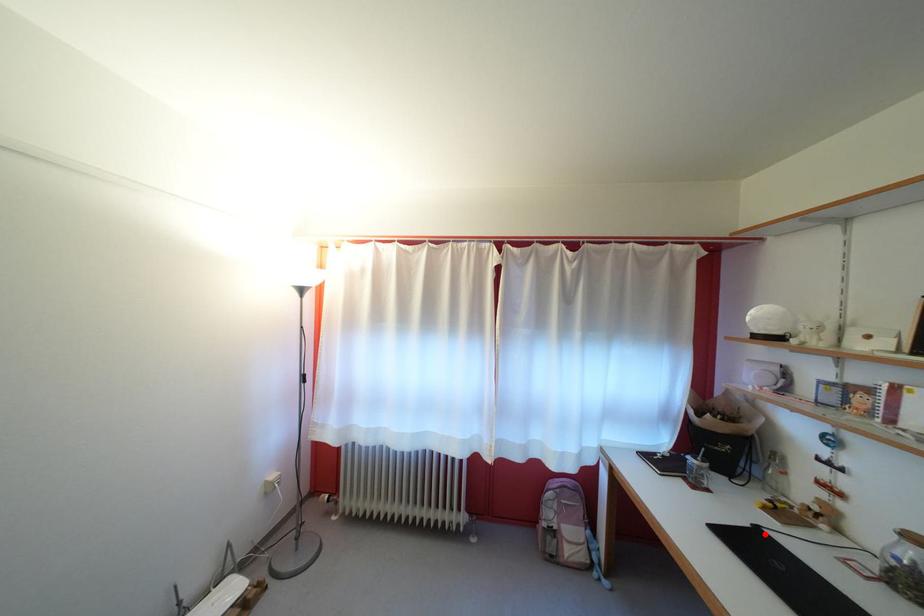
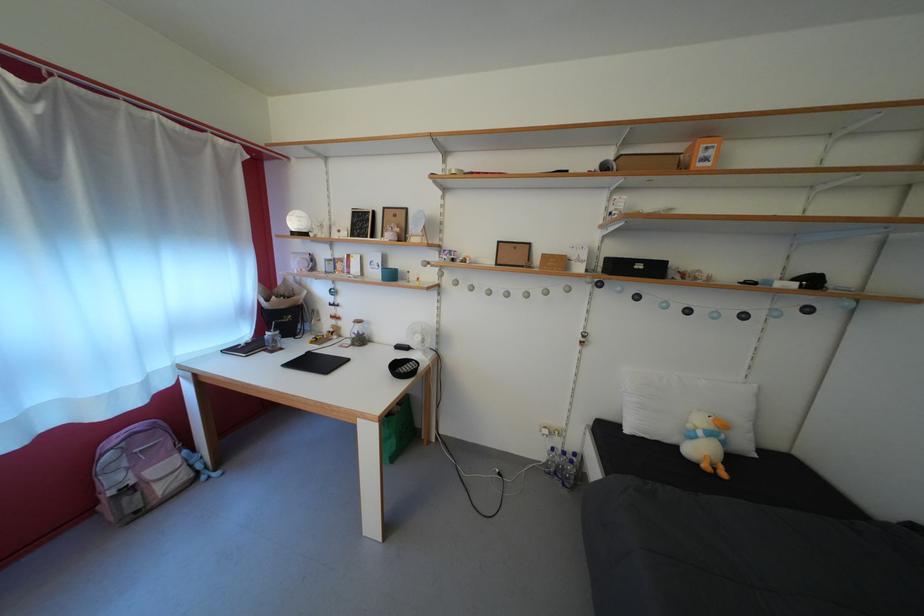
Where in the second image is the point corresponding to the highlighted location from the first image?

(317, 360)